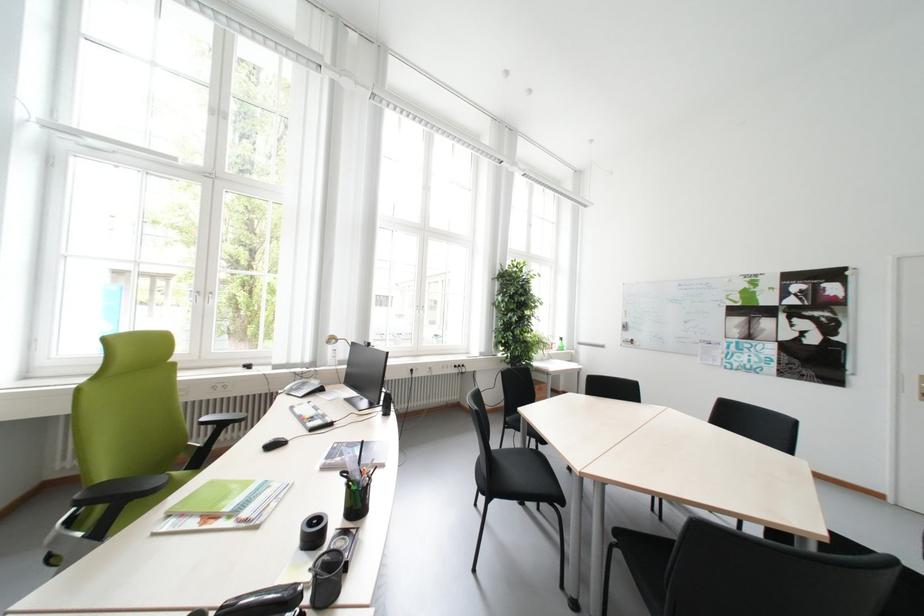
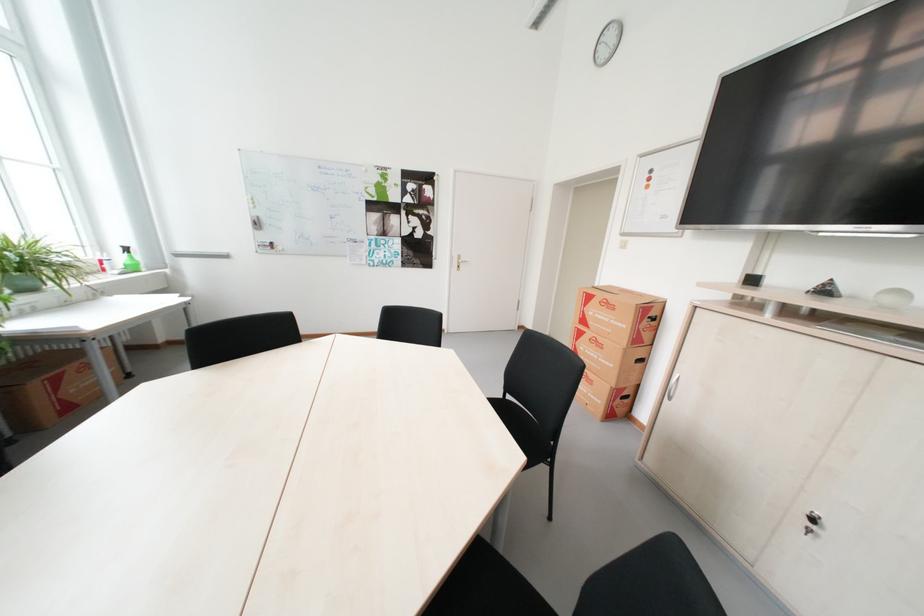
Where in the second image is the point corresponding to pixel 567 344 from the first image?

(130, 260)